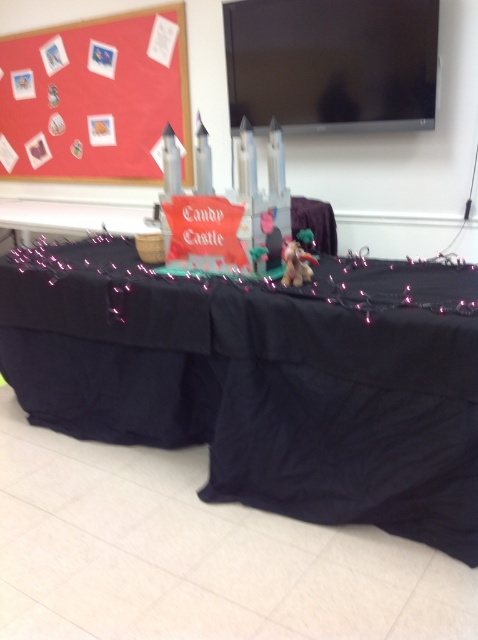
Question: Does black fabric table at center appear under red matte bulletin board at upper left?

Choices:
 (A) yes
 (B) no

Answer: (A)

Question: Which point is closer to the camera?

Choices:
 (A) (289, 264)
 (B) (34, 80)

Answer: (A)

Question: Is black fabric table at center positioned at the back of red matte bulletin board at upper left?

Choices:
 (A) no
 (B) yes

Answer: (A)

Question: Which of the following is the farthest from the observer?

Choices:
 (A) (427, 520)
 (B) (303, 243)

Answer: (B)

Question: Which point is farther to the camera?

Choices:
 (A) red matte bulletin board at upper left
 (B) satin gold unicorn at center

Answer: (A)

Question: Is red matte bulletin board at upper left bigger than satin gold unicorn at center?

Choices:
 (A) no
 (B) yes

Answer: (B)